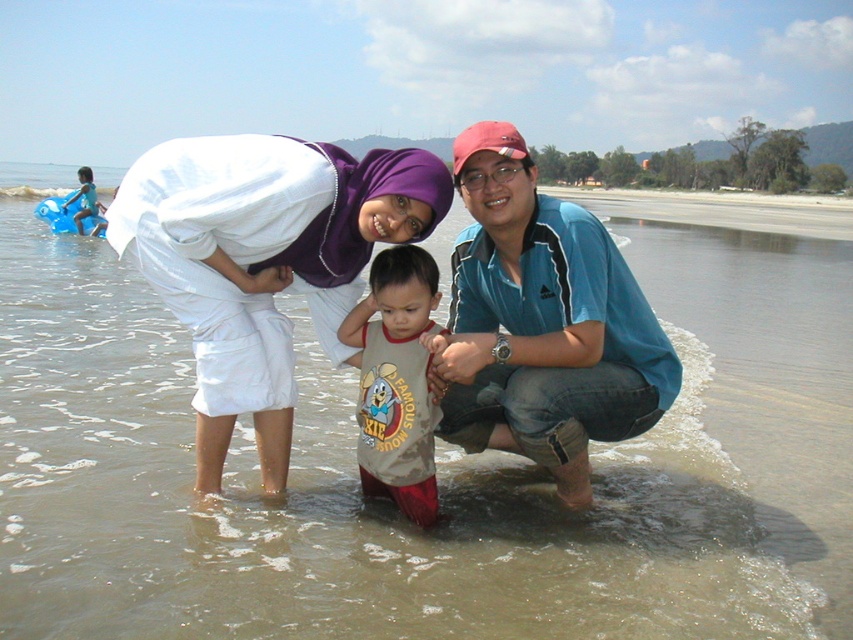
Question: Which of the following is the closest to the observer?

Choices:
 (A) (286, 280)
 (B) (274, 572)

Answer: (B)

Question: Can you confirm if white cotton hijab at upper left is positioned below light brown cotton shirt at center?

Choices:
 (A) yes
 (B) no

Answer: (B)

Question: Based on their relative distances, which object is nearer to the white cotton hijab at upper left?

Choices:
 (A) light brown cotton shirt at center
 (B) blue cotton shirt at center

Answer: (B)

Question: Is clear water at lower center wider than white cotton hijab at upper left?

Choices:
 (A) yes
 (B) no

Answer: (A)

Question: Is blue cotton shirt at center thinner than light brown cotton shirt at center?

Choices:
 (A) no
 (B) yes

Answer: (A)

Question: Which object is closer to the camera taking this photo?

Choices:
 (A) white cotton hijab at upper left
 (B) blue cotton shirt at center
 (C) light brown cotton shirt at center
 (D) clear water at lower center

Answer: (D)